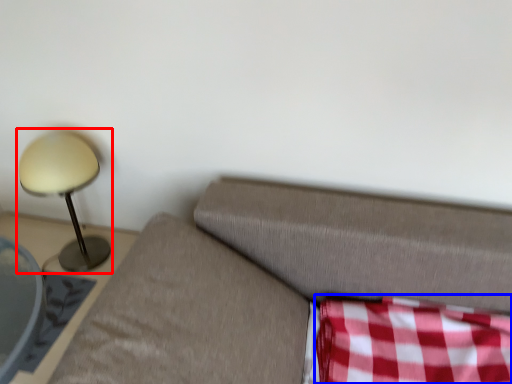
Question: Which object appears farthest to the camera in this image, lamp (highlighted by a red box) or plaid (highlighted by a blue box)?

Choices:
 (A) lamp
 (B) plaid

Answer: (A)